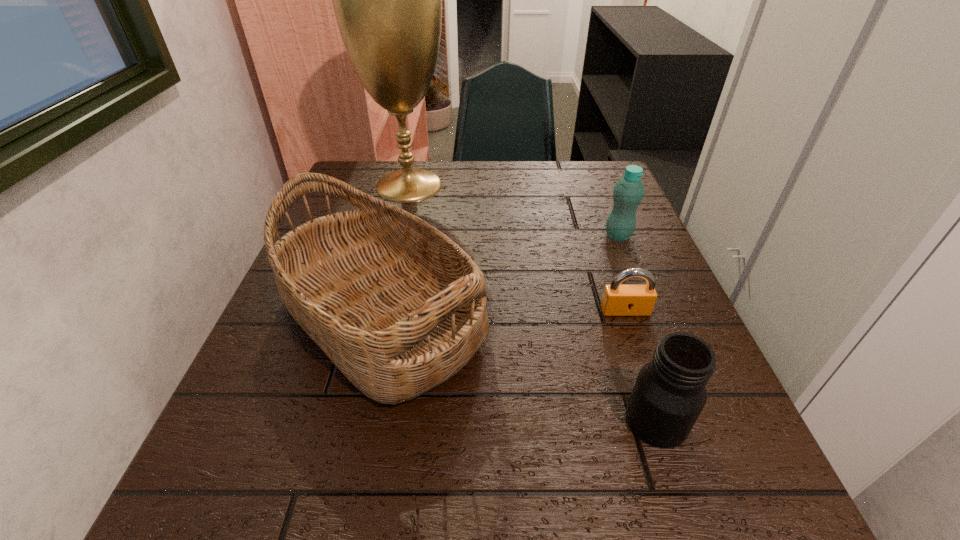
Find the location of a particular element. This screenshot has width=960, height=540. vacant area situated to unlock the shortest object from the front is located at coordinates (697, 517).

Where is `object at the far edge`? object at the far edge is located at coordinates (387, 0).

This screenshot has width=960, height=540. In order to click on trophy cup present at the left edge in this screenshot , I will do `click(387, 0)`.

The width and height of the screenshot is (960, 540). What are the coordinates of `basket at the left edge` in the screenshot? It's located at (399, 308).

I want to click on water bottle present at the right edge, so click(628, 192).

The height and width of the screenshot is (540, 960). I want to click on jar at the right edge, so click(669, 394).

The image size is (960, 540). I want to click on padlock that is at the right edge, so click(x=618, y=300).

This screenshot has width=960, height=540. I want to click on object located at the far left corner, so click(x=387, y=0).

This screenshot has height=540, width=960. In order to click on free spot at the far edge of the desktop in this screenshot , I will do `click(429, 171)`.

I want to click on free location at the near edge of the desktop, so click(x=445, y=497).